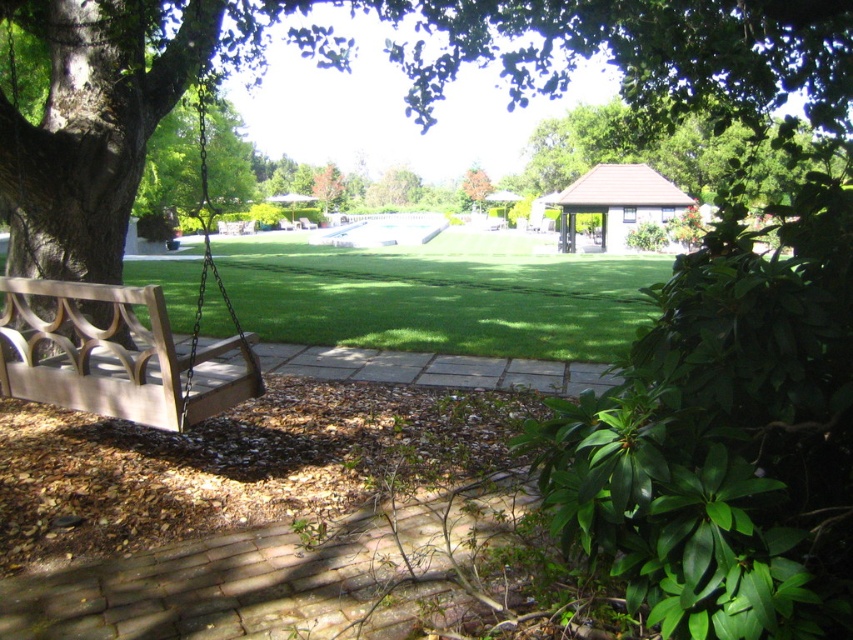
Looking at this image, you are standing at the center of the paved pathway in the middle of the image. Which direction should you walk to reach the brown wood tree at left?

The brown wood tree at left is located at point 0.100 on the x and 0.463 on the y, so you should walk towards the left and slightly forward to reach it.

You are planning to place a small garden bench in the scene. The bench requires a flat area larger than the orange matte tree at upper center. Can the green grass at center accommodate the bench?

The green grass at center has a larger size compared to the orange matte tree at upper center, so yes, the green grass at center can accommodate the bench since it is bigger in size.

You are a gardener who needs to water the green leafy tree at left using a hose that is 15 meters long. You are currently standing at the wooden park bench at left. Can you reach the tree with the hose without moving the bench?

The distance between the wooden park bench at left and the green leafy tree at left is 16.17 meters. Since the hose is only 15 meters long, you cannot reach the tree without moving the bench.